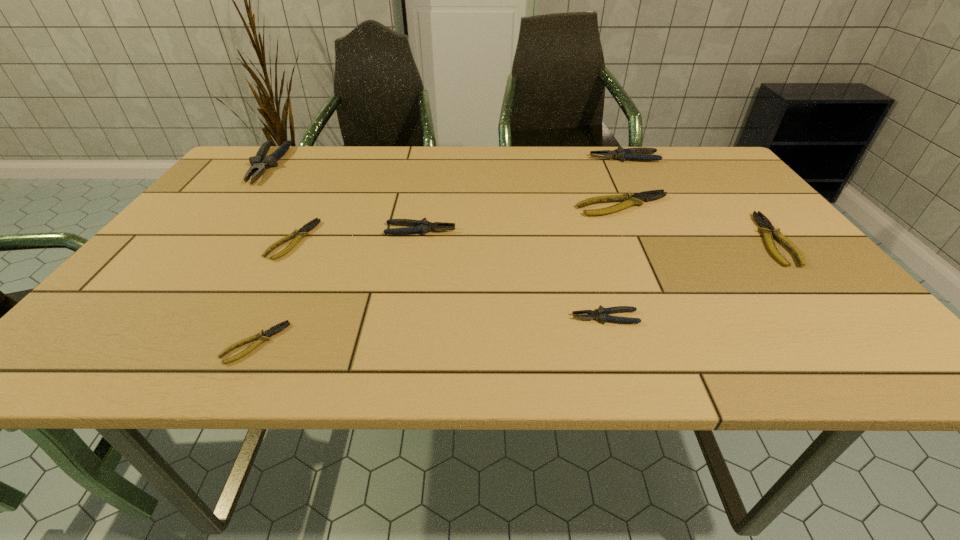
At what (x,y) coordinates should I click in order to perform the action: click on the smallest gray pliers. Please return your answer as a coordinate pair (x, y). Looking at the image, I should click on (601, 314).

Find the location of a particular element. The width and height of the screenshot is (960, 540). the second smallest yellow pliers is located at coordinates (302, 232).

At what (x,y) coordinates should I click in order to perform the action: click on the second shortest object. Please return your answer as a coordinate pair (x, y). Looking at the image, I should click on (302, 232).

The image size is (960, 540). I want to click on the nearest yellow pliers, so click(262, 336).

At what (x,y) coordinates should I click in order to perform the action: click on the shortest object. Please return your answer as a coordinate pair (x, y). Looking at the image, I should click on (262, 336).

Identify the location of vacant space located 0.120m at the gripping part of the leftmost object. The image size is (960, 540). pyautogui.click(x=232, y=209).

Locate an element on the screen. free location located at the gripping part of the rightmost gray pliers is located at coordinates (x=547, y=158).

This screenshot has height=540, width=960. I want to click on free location located at the gripping part of the rightmost gray pliers, so click(x=472, y=158).

This screenshot has height=540, width=960. I want to click on vacant area situated 0.180m at the gripping part of the rightmost gray pliers, so click(x=531, y=158).

Where is `vacant space situated 0.180m at the gripping part of the fourth object from left to right`? The width and height of the screenshot is (960, 540). vacant space situated 0.180m at the gripping part of the fourth object from left to right is located at coordinates (530, 230).